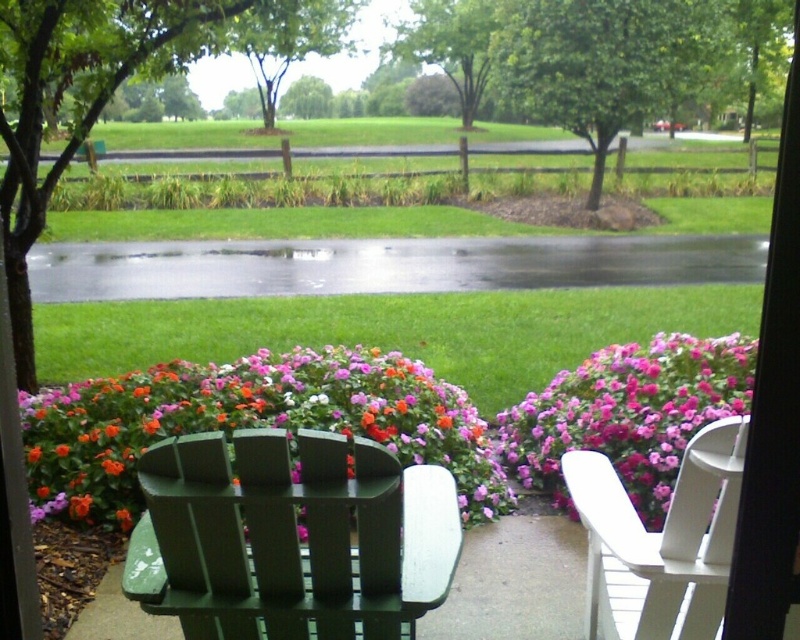
Question: Is vibrant floral bush at center positioned at the back of white wood chair at right?

Choices:
 (A) no
 (B) yes

Answer: (B)

Question: Which point is farther to the camera?

Choices:
 (A) (668, 566)
 (B) (340, 419)
 (C) (409, 554)

Answer: (B)

Question: Which of the following is the closest to the observer?

Choices:
 (A) (710, 492)
 (B) (424, 445)
 (C) (650, 400)

Answer: (A)

Question: Does pink matte flowers at right have a lesser width compared to white wood chair at right?

Choices:
 (A) no
 (B) yes

Answer: (A)

Question: Which of these objects is positioned closest to the white wood chair at right?

Choices:
 (A) green painted wood chair at lower center
 (B) vibrant floral bush at center

Answer: (A)

Question: Can you confirm if green painted wood chair at lower center is positioned to the right of pink matte flowers at right?

Choices:
 (A) yes
 (B) no

Answer: (B)